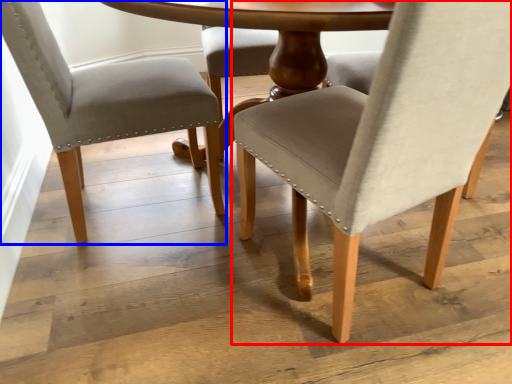
Question: Which object appears closest to the camera in this image, chair (highlighted by a red box) or chair (highlighted by a blue box)?

Choices:
 (A) chair
 (B) chair

Answer: (A)